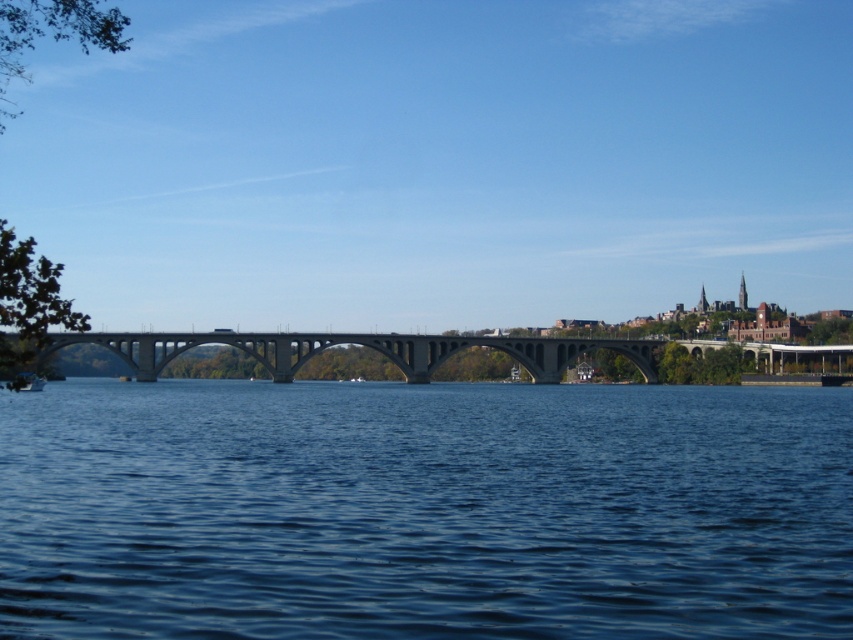
You are a boat captain navigating a narrow vessel through the river shown in the image. Your vessel requires a clear path under the concrete bridge at center to pass safely. Does the blue water at center provide enough vertical clearance for your boat to pass under the bridge?

The blue water at center is located below the concrete bridge at center, so the boat can pass under the bridge as there is space between the water and the bridge structure.

In the scene shown: You are standing at the riverside near the large multi arched bridge and want to locate two specific points. The first point is at coordinate point (32, 630) and the second is at coordinate point (305, 336). From your current position, which point is closer to you?

Point (32, 630) is in front of point (305, 336), so the first point is closer to you.